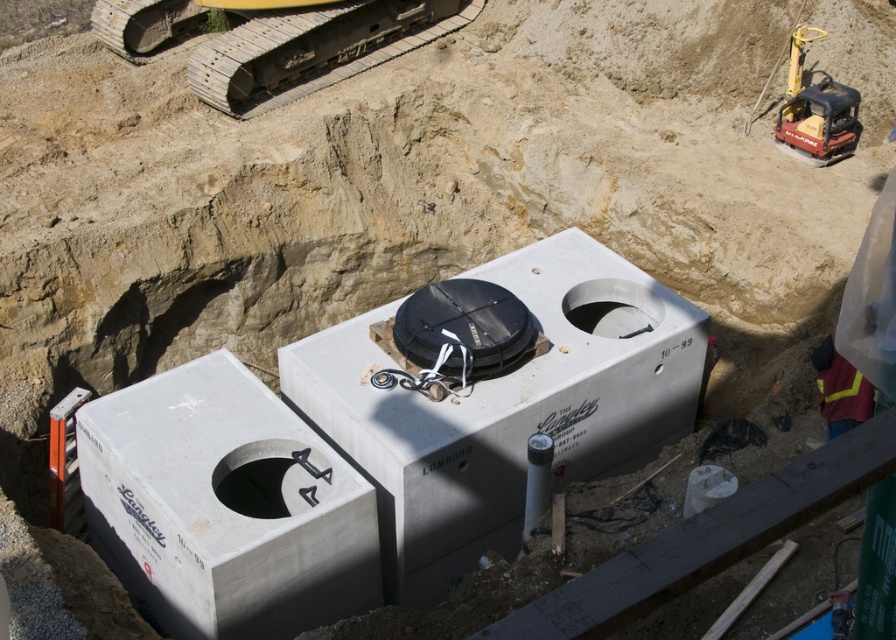
Question: Does black matte hole at center appear under smooth concrete hole at center?

Choices:
 (A) yes
 (B) no

Answer: (A)

Question: Among these objects, which one is nearest to the camera?

Choices:
 (A) smooth concrete hole at center
 (B) gray concrete water tank at center
 (C) black matte hole at center
 (D) gray metallic tracks at upper left

Answer: (B)

Question: Does gray metallic tracks at upper left have a larger size compared to reflective yellow vest at lower right?

Choices:
 (A) yes
 (B) no

Answer: (A)

Question: Considering the relative positions of gray metallic tracks at upper left and reflective yellow vest at lower right in the image provided, where is gray metallic tracks at upper left located with respect to reflective yellow vest at lower right?

Choices:
 (A) above
 (B) below

Answer: (A)

Question: Among these objects, which one is nearest to the camera?

Choices:
 (A) gray metallic tracks at upper left
 (B) black matte hole at center
 (C) smooth concrete hole at center
 (D) gray concrete water tank at center

Answer: (D)

Question: Which point appears closest to the camera in this image?

Choices:
 (A) (286, 515)
 (B) (638, 291)
 (C) (548, 371)

Answer: (C)